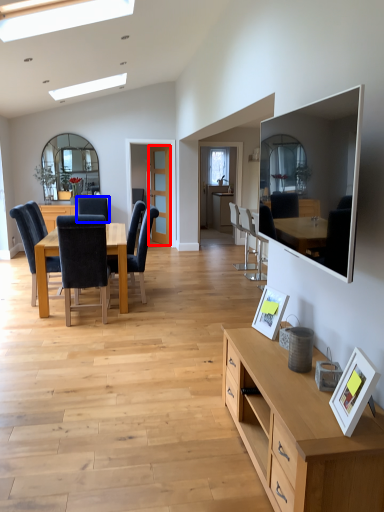
Question: Which object appears farthest to the camera in this image, glass door (highlighted by a red box) or chair (highlighted by a blue box)?

Choices:
 (A) glass door
 (B) chair

Answer: (A)